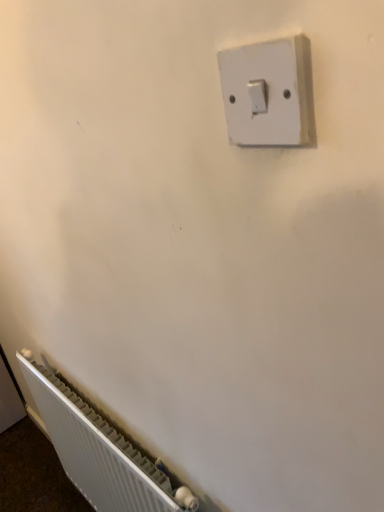
Question: Is white ribbed radiator at lower left to the left or to the right of white plastic light switch at upper center in the image?

Choices:
 (A) left
 (B) right

Answer: (A)

Question: Choose the correct answer: Is white ribbed radiator at lower left inside white plastic light switch at upper center or outside it?

Choices:
 (A) inside
 (B) outside

Answer: (B)

Question: In the image, is white ribbed radiator at lower left positioned in front of or behind white plastic light switch at upper center?

Choices:
 (A) front
 (B) behind

Answer: (B)

Question: From a real-world perspective, is white plastic light switch at upper center positioned above or below white ribbed radiator at lower left?

Choices:
 (A) above
 (B) below

Answer: (A)

Question: Is white plastic light switch at upper center in front of or behind white ribbed radiator at lower left in the image?

Choices:
 (A) front
 (B) behind

Answer: (A)

Question: From the image's perspective, is white plastic light switch at upper center positioned above or below white ribbed radiator at lower left?

Choices:
 (A) above
 (B) below

Answer: (A)

Question: Is point 258,118 positioned closer to the camera than point 99,472?

Choices:
 (A) closer
 (B) farther

Answer: (A)